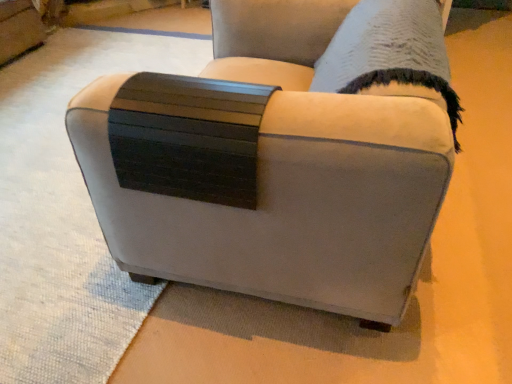
Question: Should I look upward or downward to see suede-like beige armchair at center?

Choices:
 (A) up
 (B) down

Answer: (A)